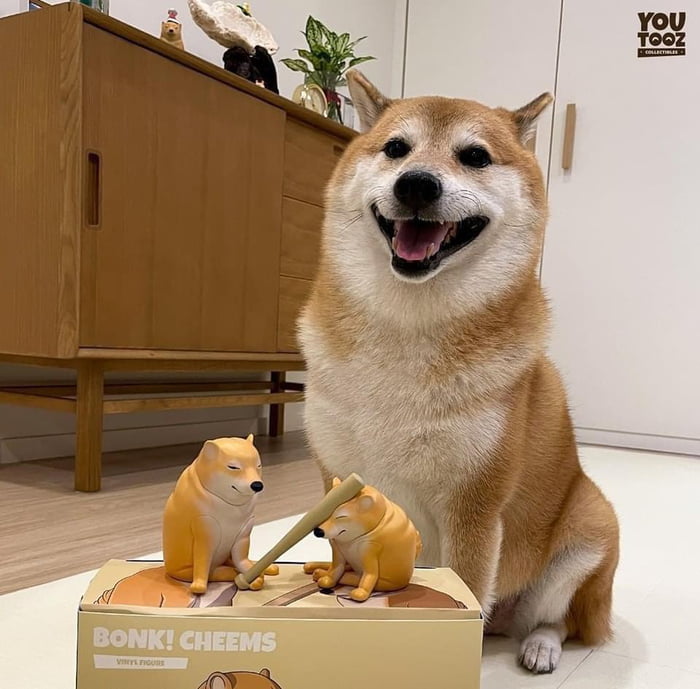
You are a GUI agent. You are given a task and a screenshot of the screen. Output one action in this format:
    pyautogui.click(x=<x>, y=<y>)
    Task: Click on the brown cabinet
    The width and height of the screenshot is (700, 689).
    Given the screenshot: What is the action you would take?
    pyautogui.click(x=194, y=233), pyautogui.click(x=55, y=218), pyautogui.click(x=290, y=249), pyautogui.click(x=297, y=171)